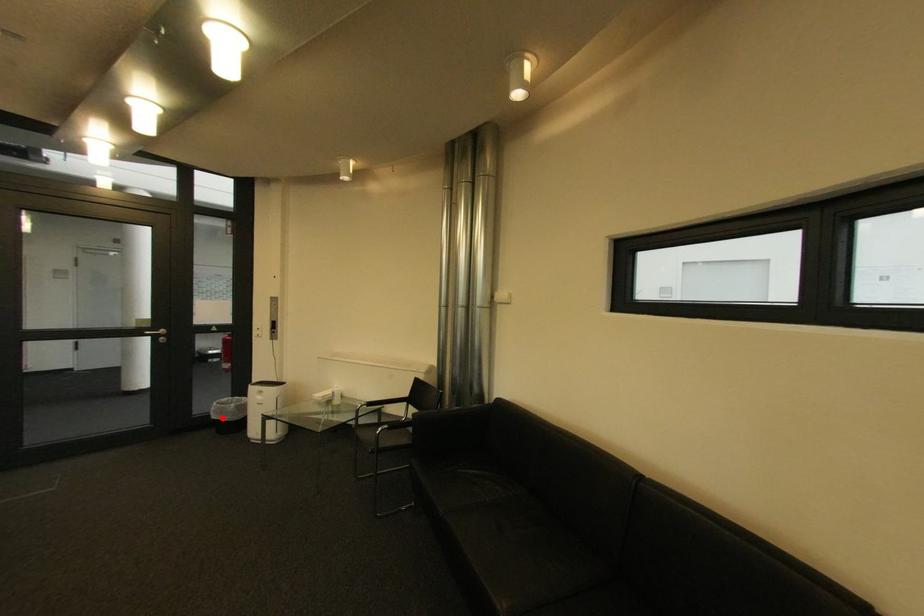
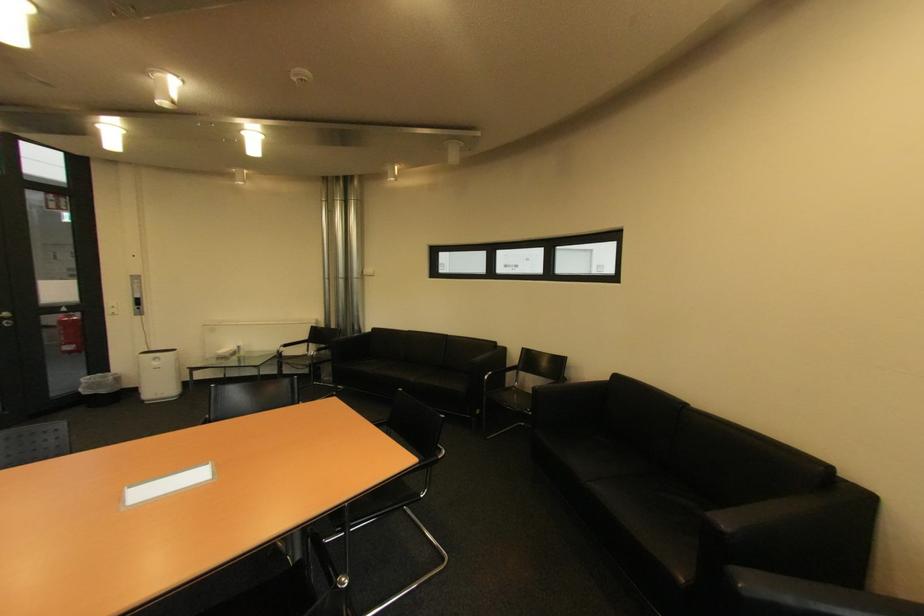
Question: I am providing you with two images of the same scene from different viewpoints. A red point is shown in image1. For the corresponding object point in image2, is it positioned nearer or farther from the camera?

Choices:
 (A) Nearer
 (B) Farther

Answer: (A)